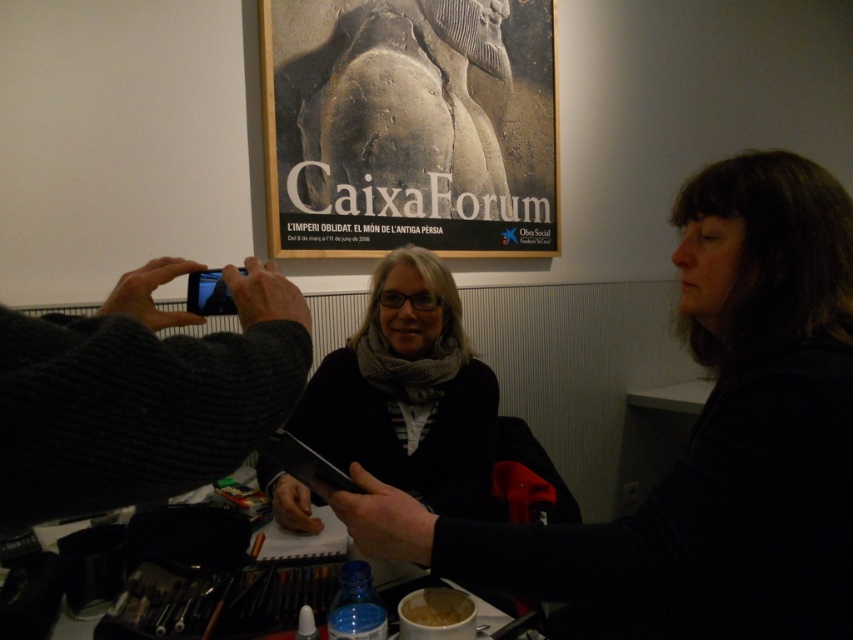
Between point (271, 468) and point (426, 614), which one is positioned in front?

Point (426, 614) is in front.

Between point (415, 467) and point (440, 612), which one is positioned behind?

Positioned behind is point (415, 467).

Is point (357, 355) farther from camera compared to point (461, 605)?

Yes.

This screenshot has width=853, height=640. What are the coordinates of `matte black scarf at center` in the screenshot? It's located at (408, 392).

Is knitted dark gray sweater at left taller than matte black scarf at center?

No.

Is knitted dark gray sweater at left behind matte black scarf at center?

No, it is in front of matte black scarf at center.

Who is more distant from viewer, (218,339) or (416,468)?

The point (416,468) is behind.

Locate an element on the screen. This screenshot has width=853, height=640. knitted dark gray sweater at left is located at coordinates (141, 394).

Which is below, dark gray sweater at center or knitted dark gray sweater at left?

dark gray sweater at center

Describe the element at coordinates (705, 442) in the screenshot. This screenshot has height=640, width=853. I see `dark gray sweater at center` at that location.

Find the location of a particular element. Image resolution: width=853 pixels, height=640 pixels. dark gray sweater at center is located at coordinates (705, 442).